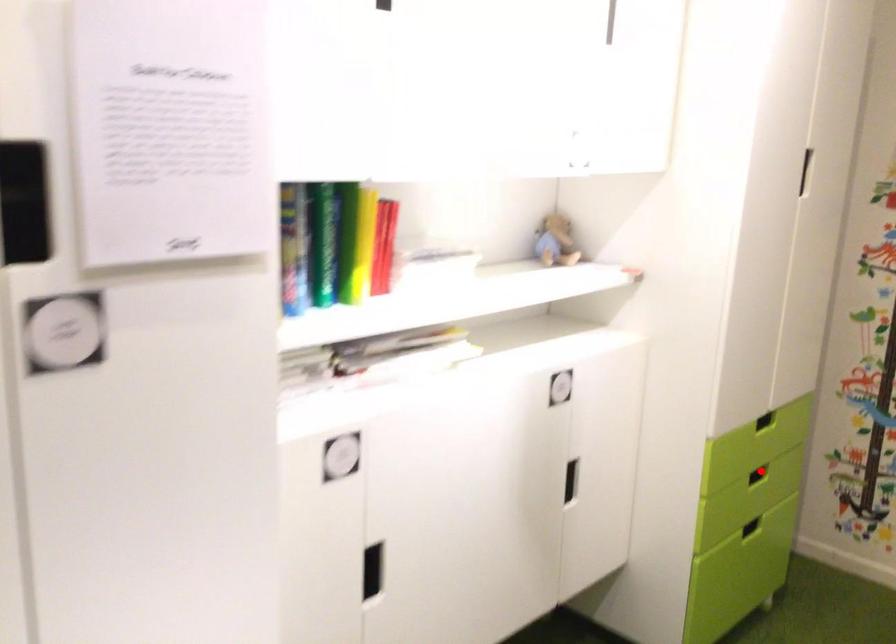
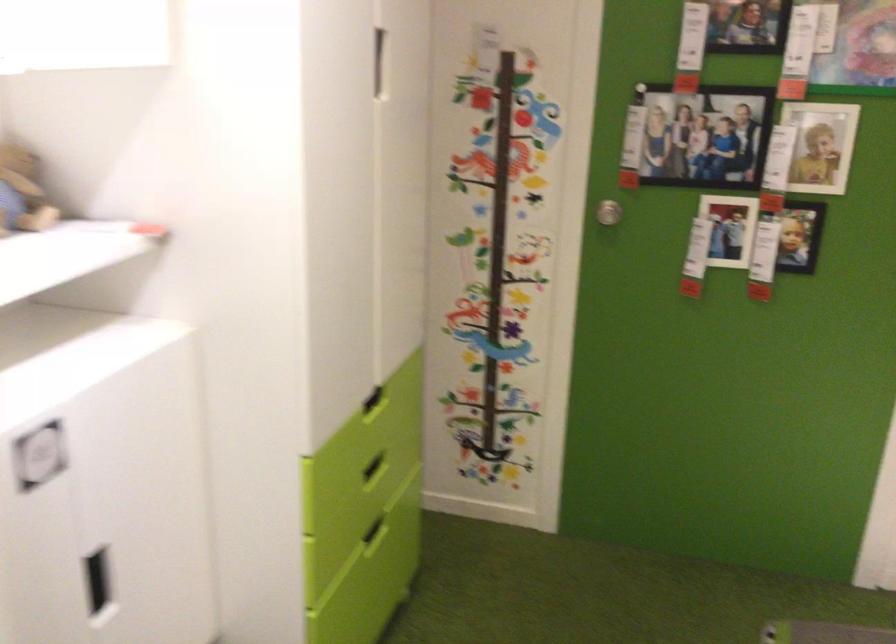
Question: I am providing you with two images of the same scene from different viewpoints. A red point is shown in image1. For the corresponding object point in image2, is it positioned nearer or farther from the camera?

Choices:
 (A) Nearer
 (B) Farther

Answer: (A)